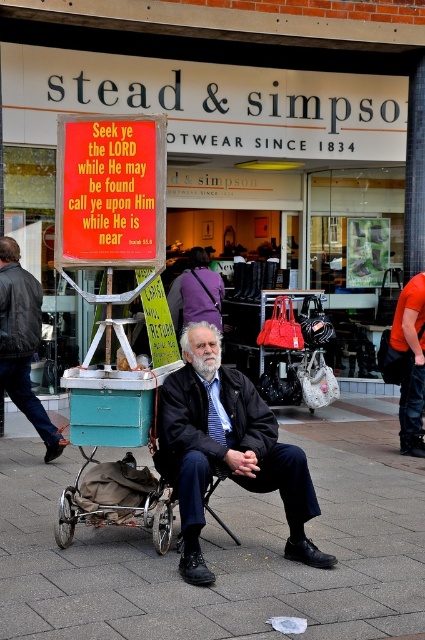
Question: Which object is the closest to the matte black sign at center?

Choices:
 (A) metallic signboard at left
 (B) orange fabric shirt at right
 (C) dark blue fabric jacket at center
 (D) paved stone pavement at center

Answer: (B)

Question: Does matte black sign at center appear under metallic signboard at left?

Choices:
 (A) no
 (B) yes

Answer: (A)

Question: Which point appears farthest from the camera in this image?

Choices:
 (A) (14, 358)
 (B) (405, 426)

Answer: (B)

Question: Can you confirm if dark blue fabric jacket at center is wider than metallic signboard at left?

Choices:
 (A) no
 (B) yes

Answer: (B)

Question: Which object appears farthest from the camera in this image?

Choices:
 (A) matte black sign at center
 (B) metallic signboard at left
 (C) dark blue fabric jacket at center

Answer: (A)

Question: Is paved stone pavement at center in front of dark blue fabric jacket at center?

Choices:
 (A) no
 (B) yes

Answer: (B)